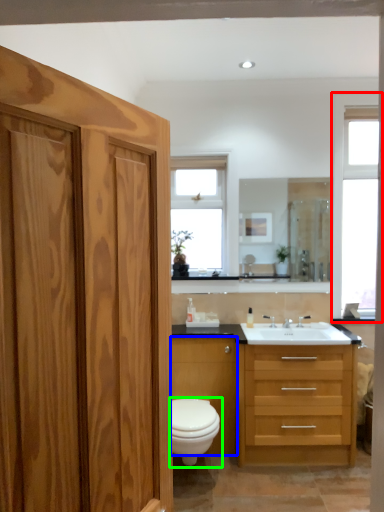
Question: Which object is the closest to the window (highlighted by a red box)? Choose among these: cabinetry (highlighted by a blue box) or toilet (highlighted by a green box).

Choices:
 (A) cabinetry
 (B) toilet

Answer: (A)